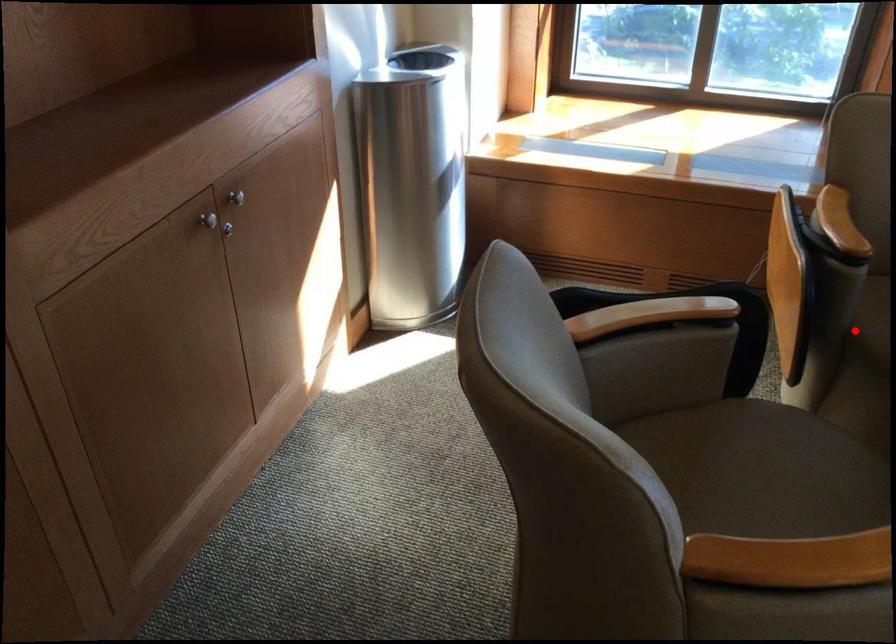
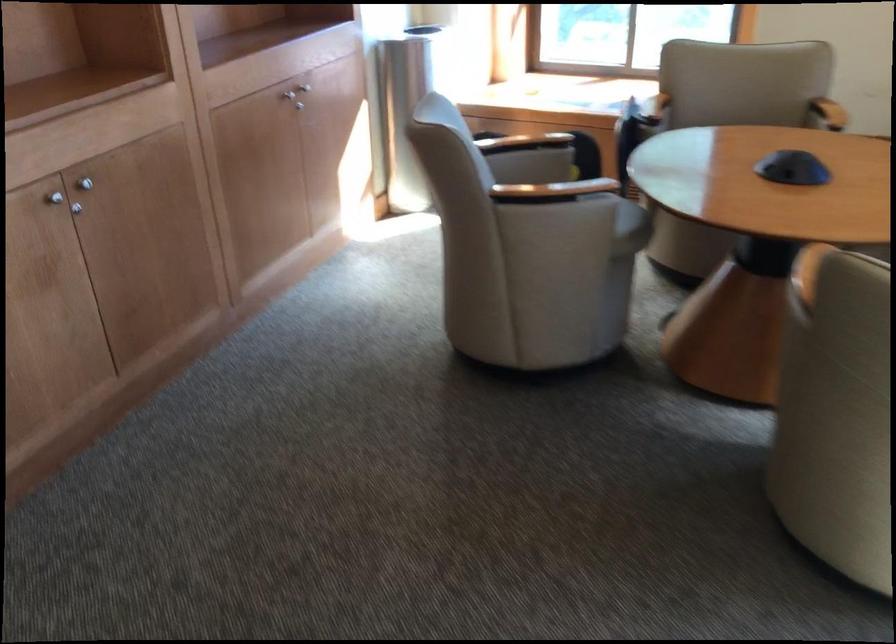
Question: I am providing you with two images of the same scene from different viewpoints. A red point is marked on the first image. Can you still see the location of the red point in image 2?

Choices:
 (A) Yes
 (B) No

Answer: (B)